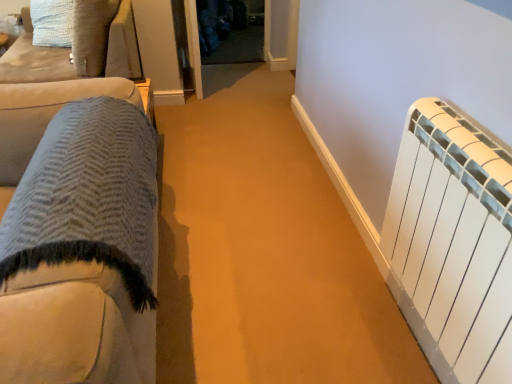
Question: Is white matte radiator at right wider than textured wool blanket at left, the first furniture from the front?

Choices:
 (A) yes
 (B) no

Answer: (B)

Question: From the image's perspective, does white matte radiator at right appear lower than textured wool blanket at left, which is counted as the 2th furniture, starting from the back?

Choices:
 (A) no
 (B) yes

Answer: (A)

Question: Can you confirm if white matte radiator at right is thinner than textured wool blanket at left, which is counted as the 2th furniture, starting from the back?

Choices:
 (A) yes
 (B) no

Answer: (A)

Question: Is white matte radiator at right aimed at textured wool blanket at left, acting as the 1th furniture starting from the right?

Choices:
 (A) no
 (B) yes

Answer: (B)

Question: Is white matte radiator at right shorter than textured wool blanket at left, which ranks as the 1th furniture in bottom-to-top order?

Choices:
 (A) no
 (B) yes

Answer: (B)

Question: Can you confirm if white matte radiator at right is positioned to the left of textured wool blanket at left, the first furniture from the front?

Choices:
 (A) yes
 (B) no

Answer: (B)

Question: Is transparent glass door at center positioned behind suede cushion at upper left, positioned as the second furniture in bottom-to-top order?

Choices:
 (A) no
 (B) yes

Answer: (B)

Question: From a real-world perspective, is transparent glass door at center on suede cushion at upper left, arranged as the second furniture when viewed from the front?

Choices:
 (A) no
 (B) yes

Answer: (A)

Question: Can you confirm if transparent glass door at center is shorter than suede cushion at upper left, arranged as the second furniture when viewed from the front?

Choices:
 (A) no
 (B) yes

Answer: (B)

Question: Is transparent glass door at center turned away from suede cushion at upper left, positioned as the 2th furniture in right-to-left order?

Choices:
 (A) no
 (B) yes

Answer: (A)

Question: Considering the relative sizes of transparent glass door at center and suede cushion at upper left, the 1th furniture in the top-to-bottom sequence, in the image provided, is transparent glass door at center bigger than suede cushion at upper left, the 1th furniture in the top-to-bottom sequence,?

Choices:
 (A) yes
 (B) no

Answer: (B)

Question: Can you confirm if transparent glass door at center is thinner than suede cushion at upper left, positioned as the second furniture in bottom-to-top order?

Choices:
 (A) no
 (B) yes

Answer: (A)

Question: From a real-world perspective, does textured wool blanket at left, which is counted as the 2th furniture, starting from the back, stand above transparent glass door at center?

Choices:
 (A) yes
 (B) no

Answer: (A)